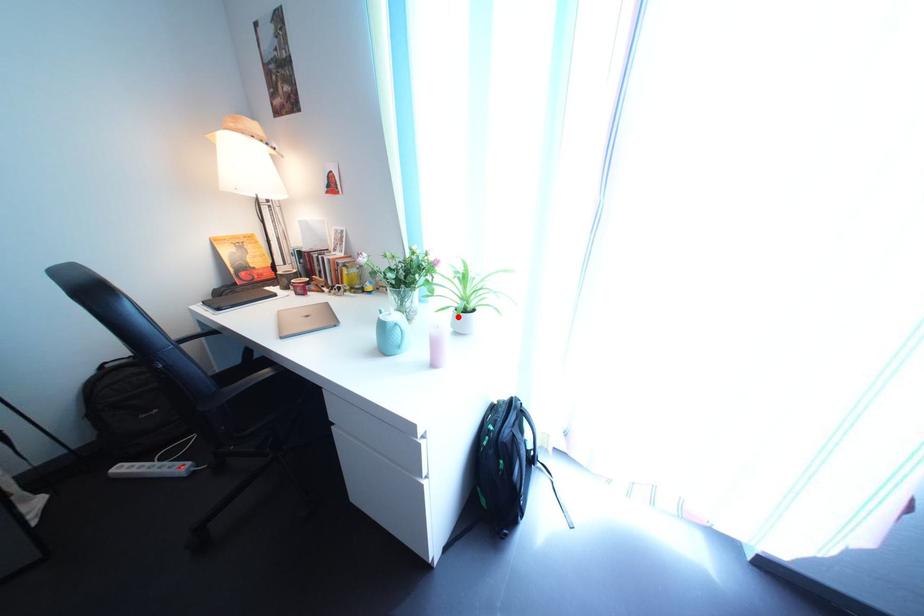
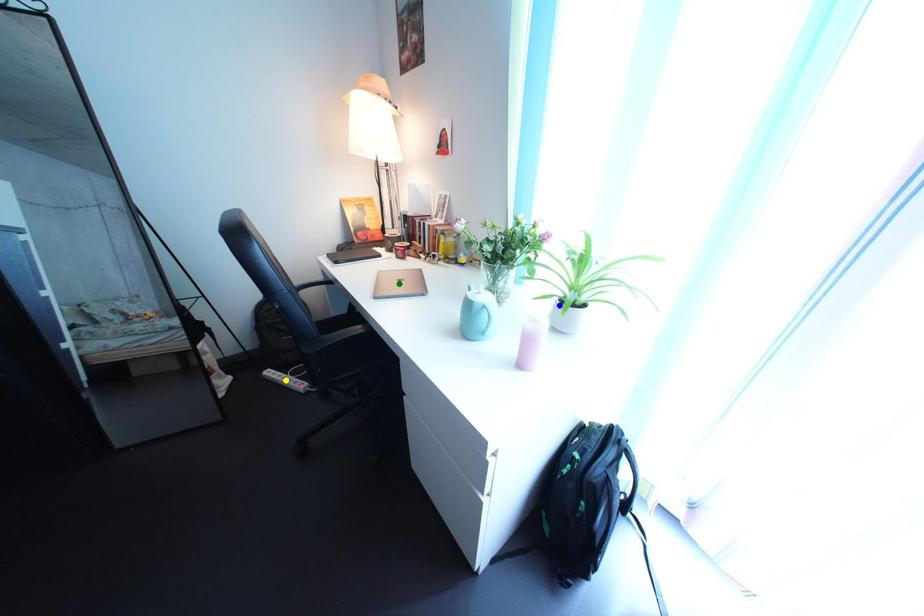
Question: I am providing you with two images of the same scene from different viewpoints. A red point is marked on the first image. You are given multiple points on the second image. In image 2, which mark is for the same physical point as the one in image 1?

Choices:
 (A) blue point
 (B) green point
 (C) yellow point

Answer: (A)